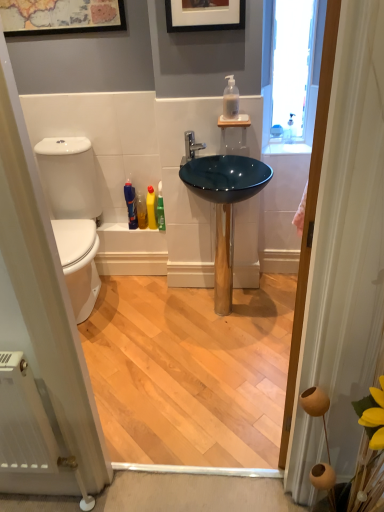
Image resolution: width=384 pixels, height=512 pixels. What do you see at coordinates (291, 71) in the screenshot? I see `transparent glass window at upper right` at bounding box center [291, 71].

Locate an element on the screen. transparent glass window at upper right is located at coordinates (291, 71).

What do you see at coordinates (160, 209) in the screenshot? I see `green glossy bottle at center, which is the 4th toiletry from left to right` at bounding box center [160, 209].

In order to click on translucent plastic soap dispenser at upper center in this screenshot , I will do `click(230, 99)`.

This screenshot has height=512, width=384. Find the location of `translucent plastic bottles at lower center, placed as the 4th toiletry when sorted from right to left`. translucent plastic bottles at lower center, placed as the 4th toiletry when sorted from right to left is located at coordinates (131, 204).

The width and height of the screenshot is (384, 512). What are the coordinates of `polished chrome faucet at center` in the screenshot? It's located at (191, 145).

Considering the positions of points (270, 170) and (279, 5), is point (270, 170) closer to camera compared to point (279, 5)?

No, it is behind (279, 5).

Does teal glossy sink at center lie behind transparent glass window at upper right?

No, the depth of teal glossy sink at center is less than that of transparent glass window at upper right.

Considering the sizes of objects teal glossy sink at center and transparent glass window at upper right in the image provided, who is wider, teal glossy sink at center or transparent glass window at upper right?

teal glossy sink at center is wider.

Which object is positioned more to the left, teal glossy sink at center or transparent glass window at upper right?

From the viewer's perspective, teal glossy sink at center appears more on the left side.

From a real-world perspective, is translucent plastic soap dispenser at upper center physically above yellow plastic bottle at lower center, which is the 2th toiletry from right to left?

Yes, from a real-world perspective, translucent plastic soap dispenser at upper center is above yellow plastic bottle at lower center, which is the 2th toiletry from right to left.

Image resolution: width=384 pixels, height=512 pixels. Identify the location of bottle above the yellow plastic bottle at lower center, which is the 2th toiletry from right to left (from the image's perspective). (230, 99).

Is translucent plastic soap dispenser at upper center not within yellow plastic bottle at lower center, which is the 2th toiletry from right to left?

Yes, translucent plastic soap dispenser at upper center is outside of yellow plastic bottle at lower center, which is the 2th toiletry from right to left.

Is translucent plastic soap dispenser at upper center facing away from yellow plastic bottle at lower center, the 3th toiletry positioned from the left?

No, translucent plastic soap dispenser at upper center is not facing the opposite direction of yellow plastic bottle at lower center, the 3th toiletry positioned from the left.

In the image, is translucent glass soap dispenser at upper right on the left side or the right side of translucent plastic bottle at lower left, placed as the third toiletry when sorted from right to left?

In the image, translucent glass soap dispenser at upper right appears on the right side of translucent plastic bottle at lower left, placed as the third toiletry when sorted from right to left.

From the image's perspective, is translucent glass soap dispenser at upper right under translucent plastic bottle at lower left, placed as the third toiletry when sorted from right to left?

Incorrect, from the image's perspective, translucent glass soap dispenser at upper right is higher than translucent plastic bottle at lower left, placed as the third toiletry when sorted from right to left.

Considering the positions of point (277, 152) and point (145, 225), is point (277, 152) closer or farther from the camera than point (145, 225)?

Point (277, 152).

Is translucent glass soap dispenser at upper right bigger than translucent plastic bottle at lower left, arranged as the second toiletry when viewed from the left?

Indeed, translucent glass soap dispenser at upper right has a larger size compared to translucent plastic bottle at lower left, arranged as the second toiletry when viewed from the left.

Find the location of a particular element. The image size is (384, 512). toiletry behind the translucent plastic bottles at lower center, which is counted as the first toiletry, starting from the left is located at coordinates (142, 211).

Is translucent plastic bottles at lower center, which is counted as the first toiletry, starting from the left, facing away from translucent plastic bottle at lower left, arranged as the second toiletry when viewed from the left?

No.

From the image's perspective, does translucent plastic bottles at lower center, placed as the 4th toiletry when sorted from right to left, appear lower than translucent plastic bottle at lower left, placed as the third toiletry when sorted from right to left?

No.

Which of these two, translucent plastic bottles at lower center, placed as the 4th toiletry when sorted from right to left, or translucent plastic bottle at lower left, arranged as the second toiletry when viewed from the left, is bigger?

Bigger between the two is translucent plastic bottles at lower center, placed as the 4th toiletry when sorted from right to left.

From a real-world perspective, is translucent glass soap dispenser at upper right physically located above or below translucent plastic bottles at lower center, which is counted as the first toiletry, starting from the left?

Clearly, from a real-world perspective, translucent glass soap dispenser at upper right is above translucent plastic bottles at lower center, which is counted as the first toiletry, starting from the left.

Is translucent glass soap dispenser at upper right next to translucent plastic bottles at lower center, placed as the 4th toiletry when sorted from right to left?

No.

Considering the positions of objects translucent glass soap dispenser at upper right and translucent plastic bottles at lower center, which is counted as the first toiletry, starting from the left, in the image provided, who is more to the right, translucent glass soap dispenser at upper right or translucent plastic bottles at lower center, which is counted as the first toiletry, starting from the left,?

translucent glass soap dispenser at upper right is more to the right.

Based on the photo, which of these two, translucent glass soap dispenser at upper right or translucent plastic bottles at lower center, which is counted as the first toiletry, starting from the left, is wider?

Wider between the two is translucent glass soap dispenser at upper right.

Can you confirm if teal glossy sink at center is wider than translucent plastic soap dispenser at upper center?

Indeed, teal glossy sink at center has a greater width compared to translucent plastic soap dispenser at upper center.

Does teal glossy sink at center contain translucent plastic soap dispenser at upper center?

Actually, translucent plastic soap dispenser at upper center is outside teal glossy sink at center.

Does point (227, 294) come behind point (236, 99)?

Yes, it is behind point (236, 99).

Does teal glossy sink at center turn towards translucent plastic soap dispenser at upper center?

No, teal glossy sink at center is not aimed at translucent plastic soap dispenser at upper center.

Considering the points (133, 225) and (150, 219), which point is in front, point (133, 225) or point (150, 219)?

Point (150, 219)

Is translucent plastic bottles at lower center, placed as the 4th toiletry when sorted from right to left, looking in the opposite direction of yellow plastic bottle at lower center, the 3th toiletry positioned from the left?

No, translucent plastic bottles at lower center, placed as the 4th toiletry when sorted from right to left, is not facing the opposite direction of yellow plastic bottle at lower center, the 3th toiletry positioned from the left.

Is yellow plastic bottle at lower center, the 3th toiletry positioned from the left, a part of translucent plastic bottles at lower center, placed as the 4th toiletry when sorted from right to left?

Definitely not — yellow plastic bottle at lower center, the 3th toiletry positioned from the left, is not inside translucent plastic bottles at lower center, placed as the 4th toiletry when sorted from right to left.

Considering the sizes of objects translucent plastic bottles at lower center, placed as the 4th toiletry when sorted from right to left, and yellow plastic bottle at lower center, the 3th toiletry positioned from the left, in the image provided, who is shorter, translucent plastic bottles at lower center, placed as the 4th toiletry when sorted from right to left, or yellow plastic bottle at lower center, the 3th toiletry positioned from the left,?

With less height is yellow plastic bottle at lower center, the 3th toiletry positioned from the left.

In the image, there is a teal glossy sink at center. Where is `window above it (from the image's perspective)`? This screenshot has width=384, height=512. window above it (from the image's perspective) is located at coordinates (291, 71).

You are a GUI agent. You are given a task and a screenshot of the screen. Output one action in this format:
    pyautogui.click(x=<x>, y=<y>)
    Task: Click on the bottle on the right of the yellow plastic bottle at lower center, which is the 2th toiletry from right to left
    The height and width of the screenshot is (512, 384).
    Given the screenshot: What is the action you would take?
    pyautogui.click(x=230, y=99)

When comparing their distances from white glossy toilet at left, does translucent plastic bottle at lower left, arranged as the second toiletry when viewed from the left, or polished chrome faucet at center seem further?

polished chrome faucet at center lies further to white glossy toilet at left than the other object.

When comparing their distances from translucent glass soap dispenser at upper right, does translucent plastic soap dispenser at upper center or teal glossy sink at center seem closer?

Among the two, teal glossy sink at center is located nearer to translucent glass soap dispenser at upper right.

From the image, which object appears to be farther from wooden door at right, transparent glass window at upper right or white glossy toilet at left?

white glossy toilet at left lies further to wooden door at right than the other object.

Looking at the image, which one is located further to teal glossy sink at center, polished chrome faucet at center or white glossy toilet at left?

white glossy toilet at left lies further to teal glossy sink at center than the other object.

Looking at this image, estimate the real-world distances between objects in this image. Which object is further from teal glossy sink at center, transparent glass window at upper right or translucent plastic bottle at lower left, arranged as the second toiletry when viewed from the left?

The object further to teal glossy sink at center is translucent plastic bottle at lower left, arranged as the second toiletry when viewed from the left.

From the image, which object appears to be farther from transparent glass window at upper right, yellow plastic bottle at lower center, which is the 2th toiletry from right to left, or teal glossy sink at center?

yellow plastic bottle at lower center, which is the 2th toiletry from right to left.

In the scene shown: Estimate the real-world distances between objects in this image. Which object is further from transparent glass window at upper right, teal glossy sink at center or green glossy bottle at center, which is the 4th toiletry from left to right?

Based on the image, green glossy bottle at center, which is the 4th toiletry from left to right, appears to be further to transparent glass window at upper right.

Looking at the image, which one is located further to translucent plastic soap dispenser at upper center, wooden door at right or teal glossy sink at center?

wooden door at right is further to translucent plastic soap dispenser at upper center.

Locate an element on the screen. The image size is (384, 512). counter top between translucent plastic soap dispenser at upper center and teal glossy sink at center in the up-down direction is located at coordinates (286, 148).

The width and height of the screenshot is (384, 512). Identify the location of tap between transparent glass window at upper right and teal glossy sink at center in the vertical direction. (191, 145).

Find the location of a particular element. The height and width of the screenshot is (512, 384). tap between teal glossy sink at center and yellow plastic bottle at lower center, the 3th toiletry positioned from the left, from front to back is located at coordinates (191, 145).

Locate an element on the screen. The image size is (384, 512). tap between wooden door at right and translucent plastic bottle at lower left, placed as the third toiletry when sorted from right to left, along the z-axis is located at coordinates (191, 145).